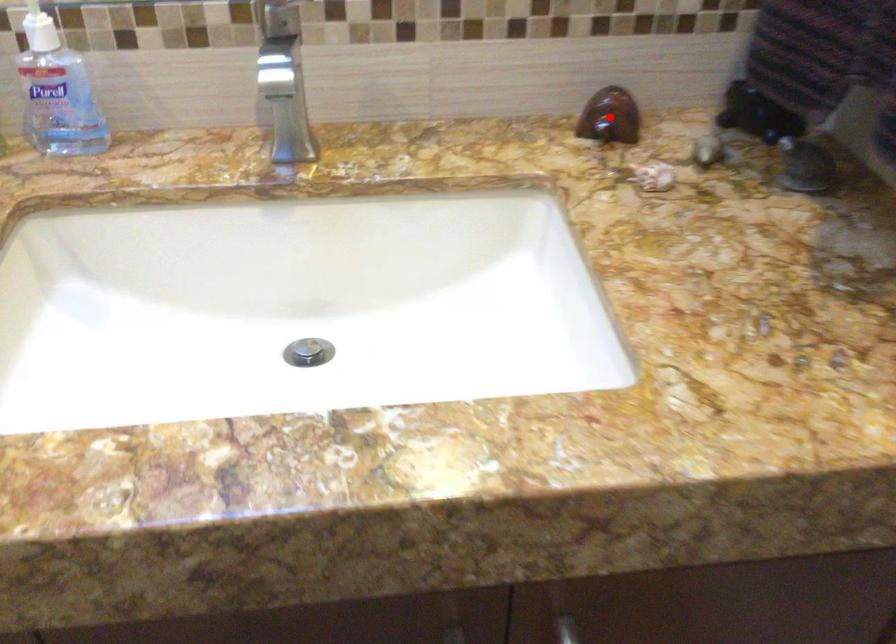
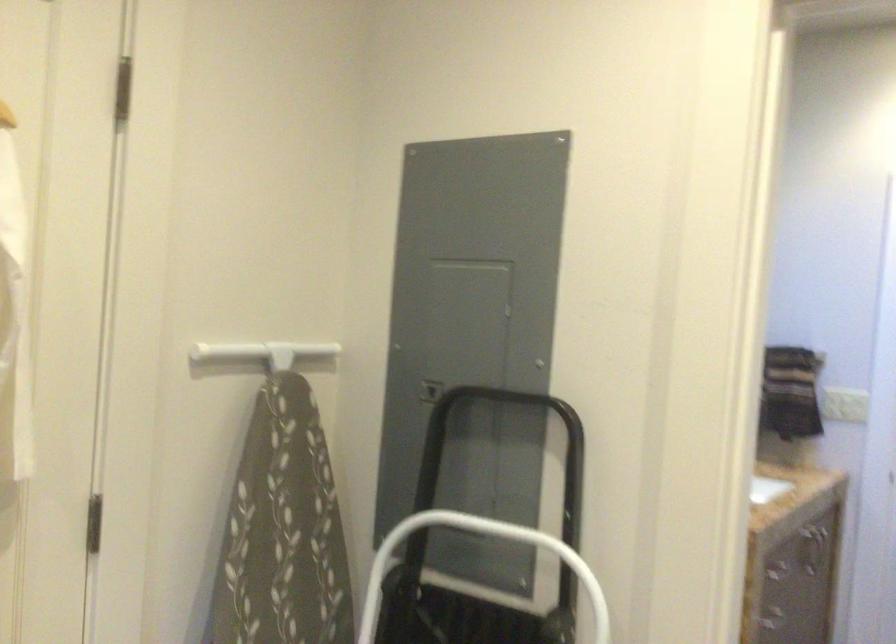
Question: I am providing you with two images of the same scene from different viewpoints. A red point is marked on the first image. At the location where the point appears in image 1, is it still visible in image 2?

Choices:
 (A) Yes
 (B) No

Answer: (B)